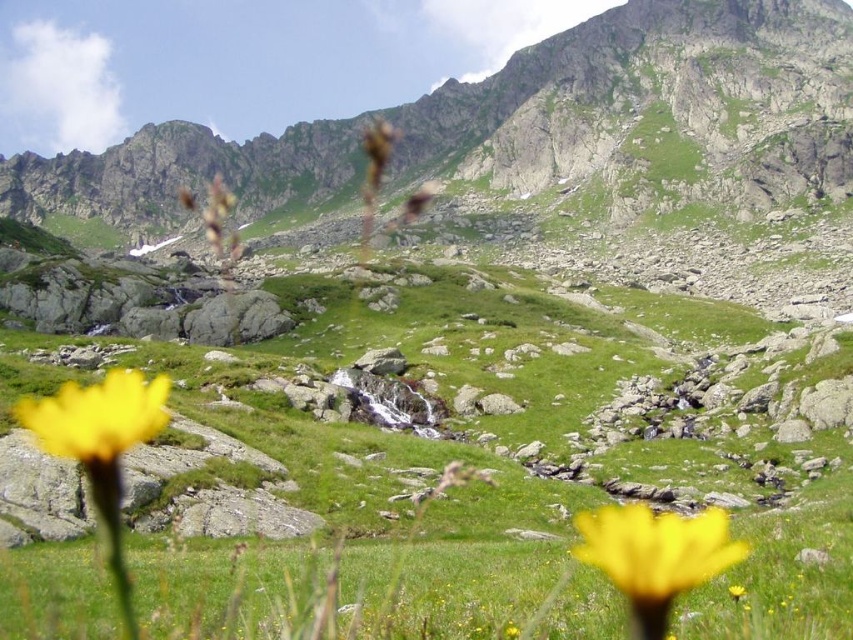
Can you confirm if green rocky mountain at upper center is shorter than yellow matte flower at lower center?

Incorrect, green rocky mountain at upper center's height does not fall short of yellow matte flower at lower center's.

Is green rocky mountain at upper center smaller than yellow matte flower at lower center?

No.

Where is `green rocky mountain at upper center`? This screenshot has height=640, width=853. green rocky mountain at upper center is located at coordinates (654, 97).

Between point (154, 428) and point (729, 593), which one is positioned in front?

Point (729, 593) is more forward.

Which is behind, point (51, 451) or point (730, 596)?

The point (51, 451) is behind.

Image resolution: width=853 pixels, height=640 pixels. What do you see at coordinates (97, 417) in the screenshot?
I see `bright yellow flower at lower left` at bounding box center [97, 417].

What are the coordinates of `bright yellow flower at lower left` in the screenshot? It's located at (97, 417).

Which is above, yellow matte flower at lower right or bright yellow flower at lower left?

bright yellow flower at lower left is higher up.

Does yellow matte flower at lower right appear on the left side of bright yellow flower at lower left?

In fact, yellow matte flower at lower right is to the right of bright yellow flower at lower left.

I want to click on yellow matte flower at lower right, so click(x=656, y=548).